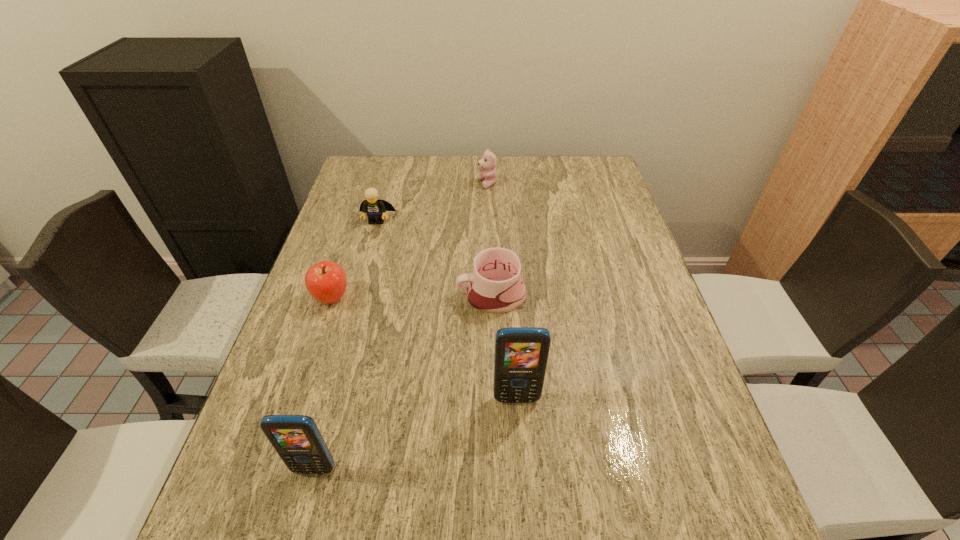
Find the location of a particular element. The width and height of the screenshot is (960, 540). the left cellular telephone is located at coordinates (296, 438).

I want to click on the nearest object, so click(296, 438).

The width and height of the screenshot is (960, 540). Find the location of `the right cellular telephone`. the right cellular telephone is located at coordinates (521, 353).

Find the location of a particular element. The image size is (960, 540). the farther cellular telephone is located at coordinates coord(521,353).

Image resolution: width=960 pixels, height=540 pixels. In order to click on teddy bear in this screenshot , I will do `click(488, 162)`.

You are a GUI agent. You are given a task and a screenshot of the screen. Output one action in this format:
    pyautogui.click(x=<x>, y=<y>)
    Task: Click on the fifth nearest object
    
    Given the screenshot: What is the action you would take?
    pyautogui.click(x=375, y=209)

Locate an element on the screen. mug is located at coordinates (495, 286).

Locate an element on the screen. The image size is (960, 540). apple is located at coordinates (326, 281).

Find the location of a particular element. This screenshot has width=960, height=540. free space located on the screen of the right cellular telephone is located at coordinates (521, 465).

At what (x,y) coordinates should I click in order to perform the action: click on free spot located at the face of the farthest object. Please return your answer as a coordinate pair (x, y). Looking at the image, I should click on (450, 184).